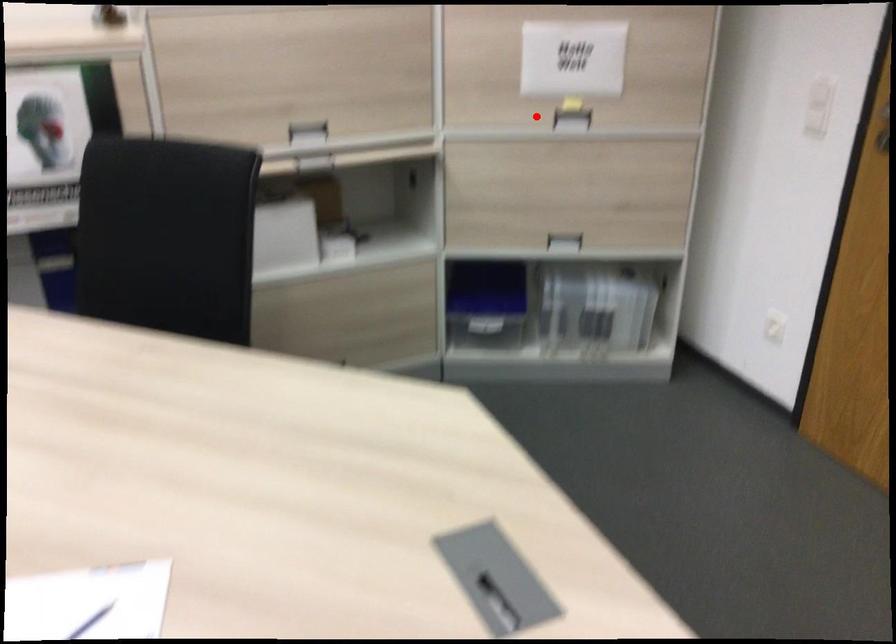
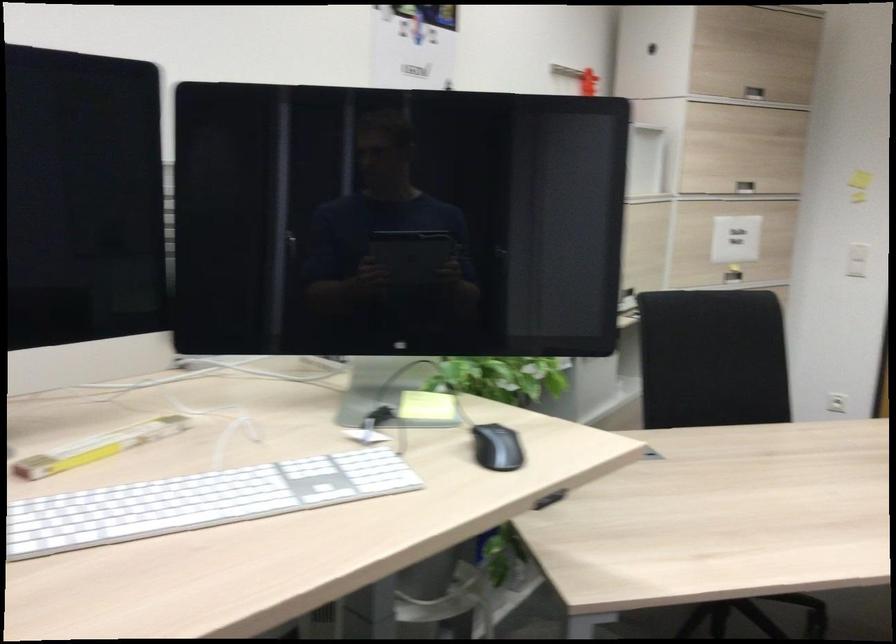
Where in the second image is the point corresponding to the highlighted location from the first image?

(733, 275)